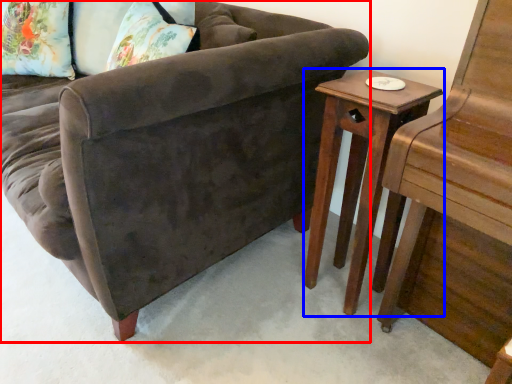
Question: Which object is further to the camera taking this photo, studio couch (highlighted by a red box) or table (highlighted by a blue box)?

Choices:
 (A) studio couch
 (B) table

Answer: (B)